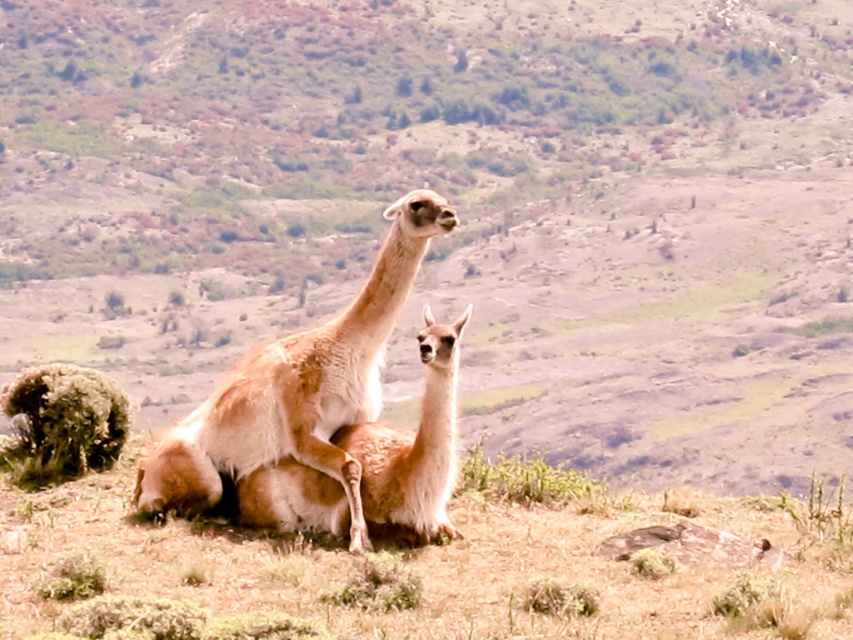
You are a hiker who has just arrived at this grassy hillside. You notice a point marked at coordinates (297, 387). What animal is located at that specific point?

The light brown woolen alpaca at center is located at point (297, 387).

From the picture: You are a wildlife photographer trying to capture a clear photo of both the light brown woolen alpaca at center and the fuzzy brown alpaca at center. Since you want both animals to be in focus, you need to know which one is closer to you. Can you determine which alpaca is closer based on their positions?

The light brown woolen alpaca at center is positioned over the fuzzy brown alpaca at center, so the fuzzy brown alpaca at center is closer to you because it is underneath the other one.